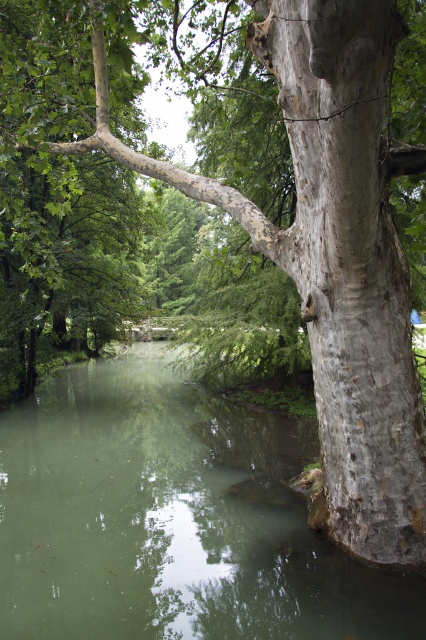
Can you confirm if green smooth water at center is smaller than smooth gray bark at right?

No, green smooth water at center is not smaller than smooth gray bark at right.

Measure the distance between green smooth water at center and camera.

green smooth water at center is 4.07 meters from camera.

Locate an element on the screen. green smooth water at center is located at coordinates (172, 518).